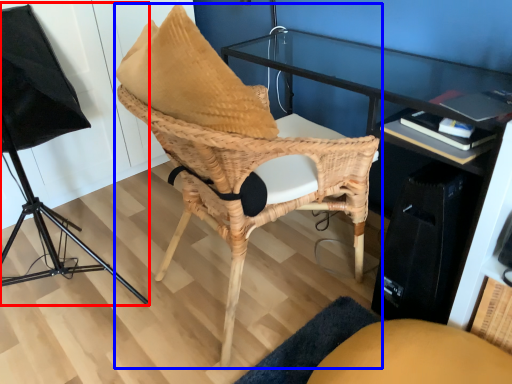
Question: Which object appears closest to the camera in this image, lamp (highlighted by a red box) or chair (highlighted by a blue box)?

Choices:
 (A) lamp
 (B) chair

Answer: (A)